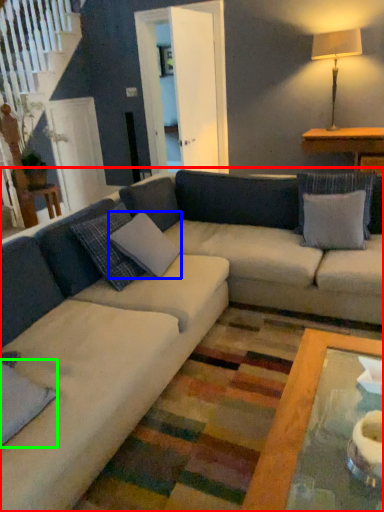
Question: Considering the real-world distances, which object is farthest from studio couch (highlighted by a red box)? pillow (highlighted by a blue box) or pillow (highlighted by a green box)?

Choices:
 (A) pillow
 (B) pillow

Answer: (B)